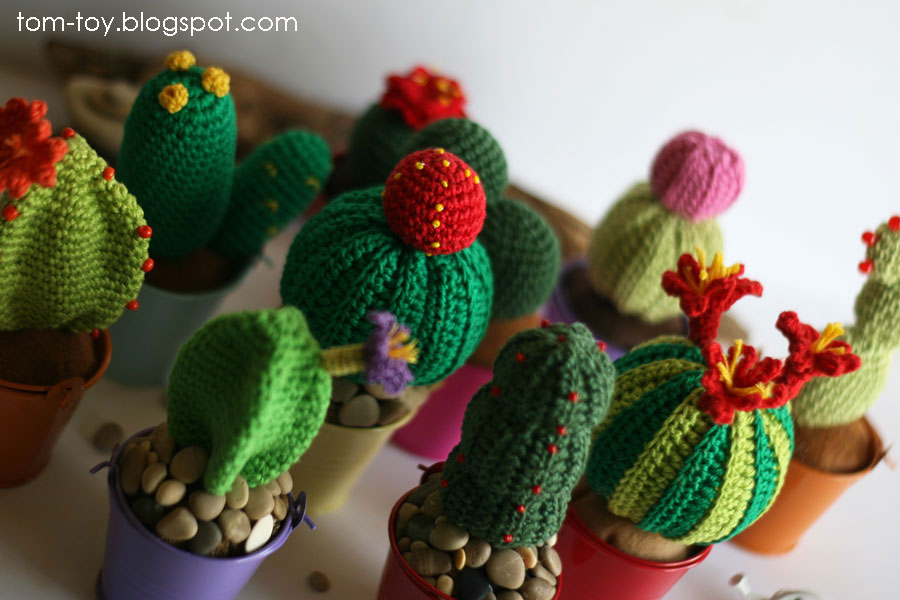
You are a GUI agent. You are given a task and a screenshot of the screen. Output one action in this format:
    pyautogui.click(x=<x>, y=<y>)
    Task: Click on the white table
    Image resolution: width=900 pixels, height=600 pixels.
    Given the screenshot: What is the action you would take?
    click(x=365, y=538)